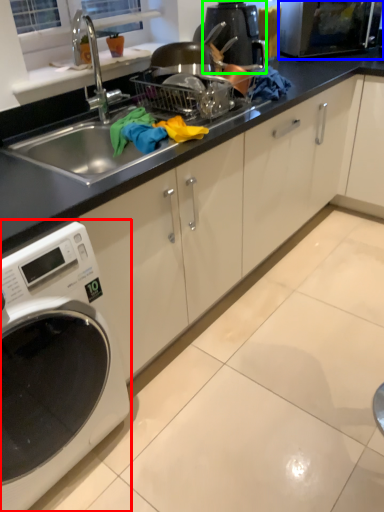
Question: Which object is the farthest from home appliance (highlighted by a red box)? Choose among these: microwave oven (highlighted by a blue box) or coffee machine (highlighted by a green box).

Choices:
 (A) microwave oven
 (B) coffee machine

Answer: (A)